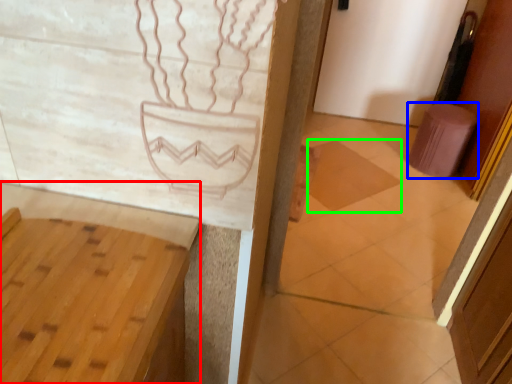
Question: Which object is positioned closest to vanity (highlighted by a red box)? Select from stool (highlighted by a blue box) and tile (highlighted by a green box).

Choices:
 (A) stool
 (B) tile

Answer: (B)